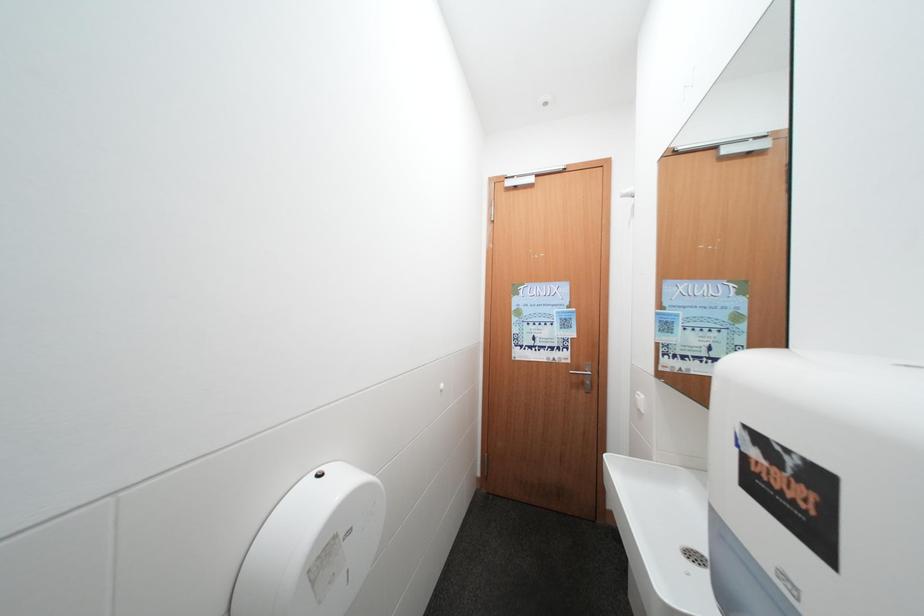
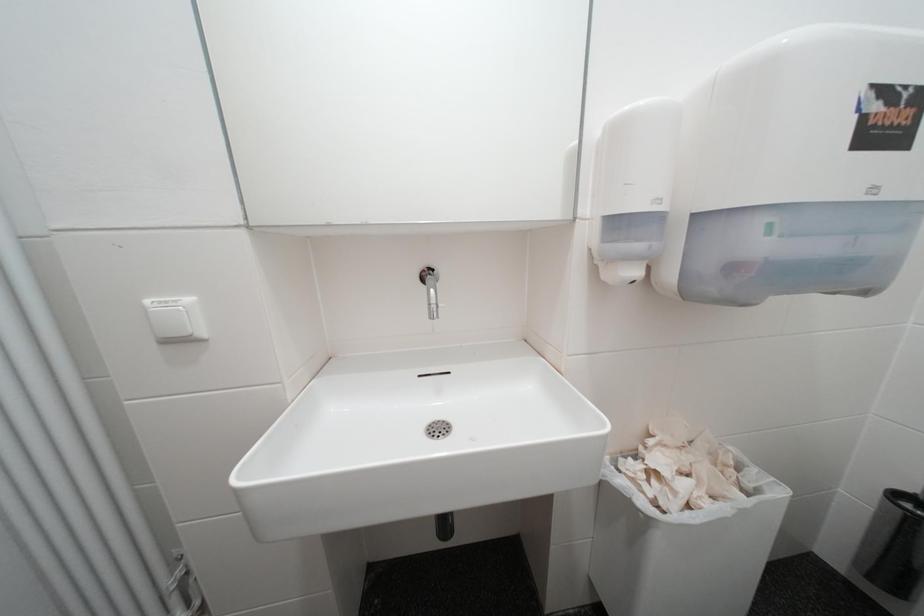
Question: The camera is either moving clockwise (left) or counter-clockwise (right) around the object. The first image is from the beginning of the video and the second image is from the end. Is the camera moving left or right when shooting the video?

Choices:
 (A) Left
 (B) Right

Answer: (A)